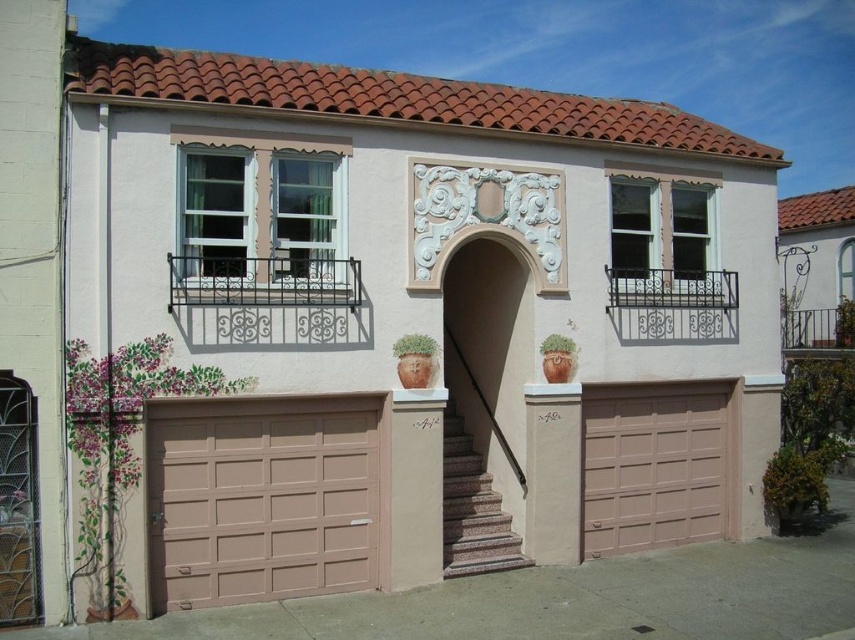
Based on the photo, who is more forward, (163, 595) or (479, 570)?

Positioned in front is point (163, 595).

Can you confirm if tan matte garage door at lower left is positioned to the right of granite stairs at center?

Incorrect, tan matte garage door at lower left is not on the right side of granite stairs at center.

You are a GUI agent. You are given a task and a screenshot of the screen. Output one action in this format:
    pyautogui.click(x=<x>, y=<y>)
    Task: Click on the tan matte garage door at lower left
    The image size is (855, 640).
    Given the screenshot: What is the action you would take?
    pyautogui.click(x=261, y=499)

Does tan matte garage door at lower left lie in front of beige textured garage door at center?

Yes.

The width and height of the screenshot is (855, 640). Describe the element at coordinates (261, 499) in the screenshot. I see `tan matte garage door at lower left` at that location.

Where is `tan matte garage door at lower left`? Image resolution: width=855 pixels, height=640 pixels. tan matte garage door at lower left is located at coordinates (261, 499).

Identify the location of tan matte garage door at lower left. (261, 499).

Who is more forward, (690, 426) or (478, 561)?

Positioned in front is point (478, 561).

Which is behind, point (643, 426) or point (482, 545)?

The point (643, 426) is more distant.

Which is in front, point (587, 410) or point (473, 529)?

Point (473, 529) is in front.

You are a GUI agent. You are given a task and a screenshot of the screen. Output one action in this format:
    pyautogui.click(x=<x>, y=<y>)
    Task: Click on the beige textured garage door at center
    This screenshot has width=855, height=640.
    Given the screenshot: What is the action you would take?
    point(655,465)